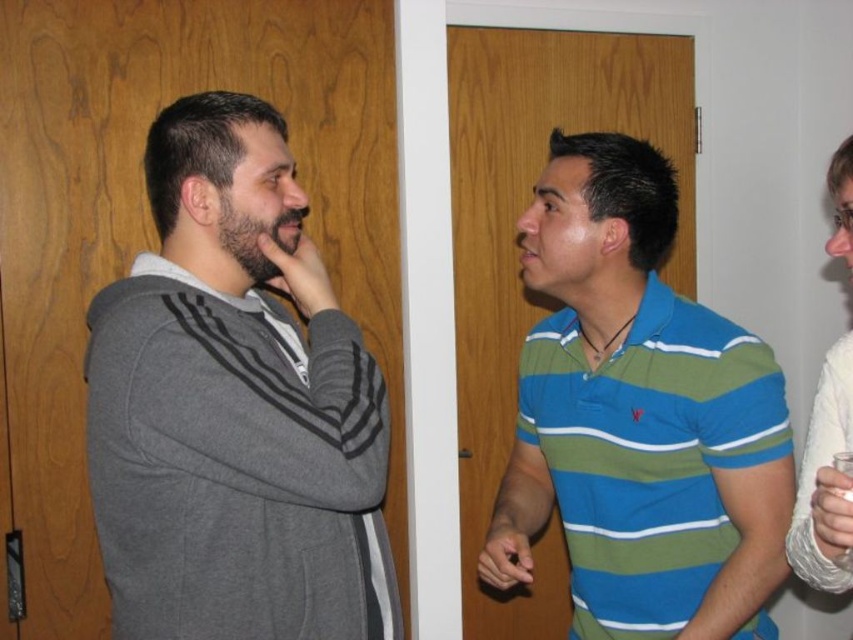
In the scene shown: You are trying to decide which clothing item to take with you based on their lengths. Which one is shorter between the gray fleece jacket at left and the striped cotton polo shirt at center?

The gray fleece jacket at left is shorter than the striped cotton polo shirt at center, so you should choose the gray fleece jacket at left if you prefer a shorter length.

From the picture: Based on the coordinates provided, which object is located at point (234, 406)?

The point (234, 406) indicates the gray fleece jacket at left.